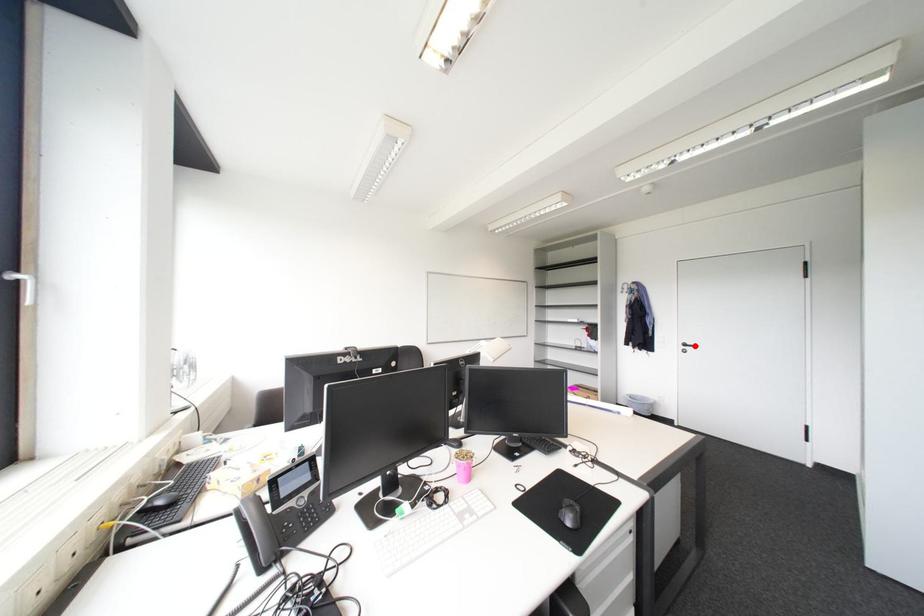
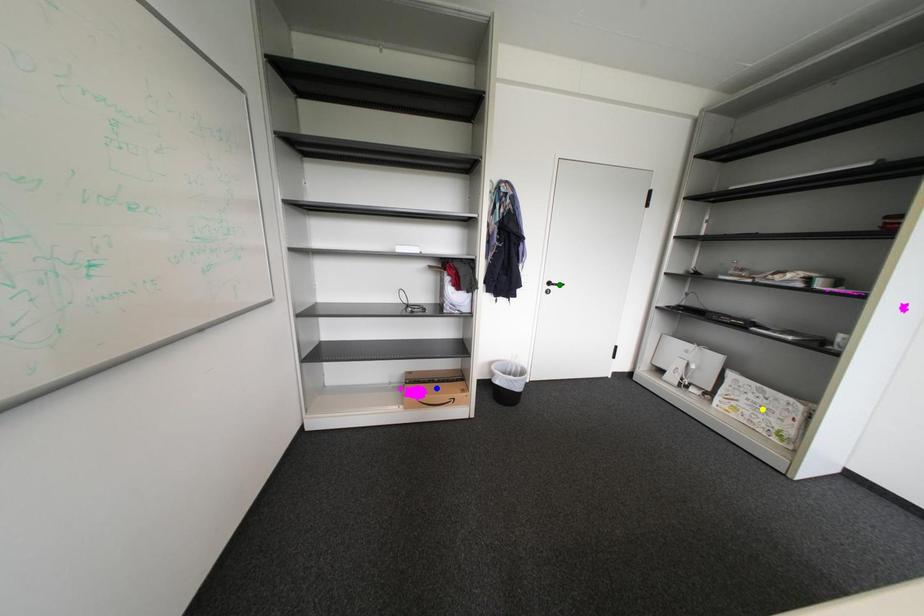
Question: I am providing you with two images of the same scene from different viewpoints. A red point is marked on the first image. You are given multiple points on the second image. In image 2, which mark is for the same physical point as the one in image 1?

Choices:
 (A) yellow point
 (B) green point
 (C) blue point

Answer: (B)